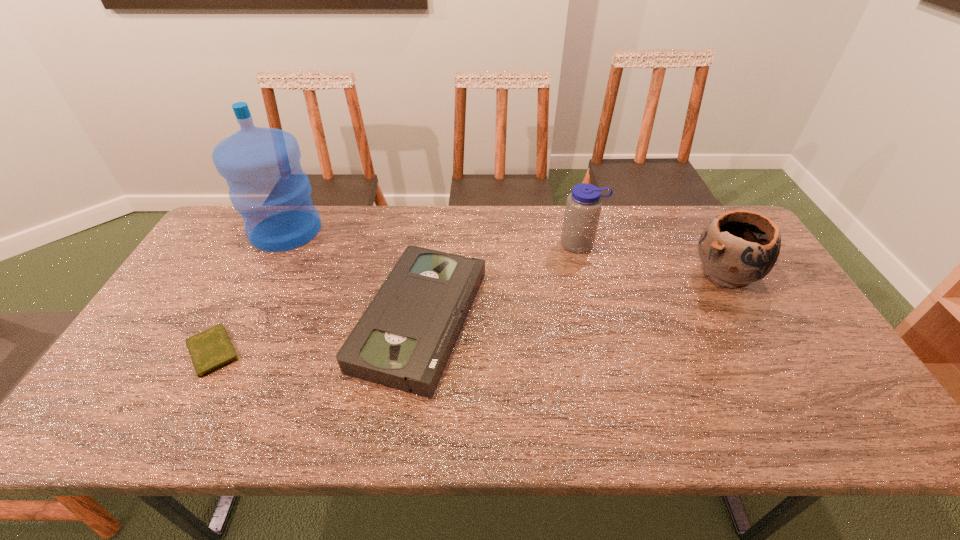
Find the location of a particular element. vacant space at the right edge of the desktop is located at coordinates (785, 351).

The height and width of the screenshot is (540, 960). Identify the location of vacant space at the far left corner of the desktop. (244, 234).

In the image, there is a desktop. Where is `vacant space at the far right corner`? This screenshot has height=540, width=960. vacant space at the far right corner is located at coordinates (689, 222).

Where is `empty location between the rightmost object and the second shortest object`? empty location between the rightmost object and the second shortest object is located at coordinates (572, 296).

Locate an element on the screen. The image size is (960, 540). vacant point located between the tallest object and the shortest object is located at coordinates (250, 291).

Locate an element on the screen. Image resolution: width=960 pixels, height=540 pixels. unoccupied position between the rightmost object and the water bottle is located at coordinates (652, 259).

This screenshot has width=960, height=540. Identify the location of unoccupied position between the water jug and the water bottle. (433, 237).

Where is `free space that is in between the pottery and the tallest object`? This screenshot has height=540, width=960. free space that is in between the pottery and the tallest object is located at coordinates (505, 252).

I want to click on free spot between the third object from left to right and the water jug, so click(x=353, y=275).

Where is `empty location between the water jug and the pottery`? empty location between the water jug and the pottery is located at coordinates (505, 252).